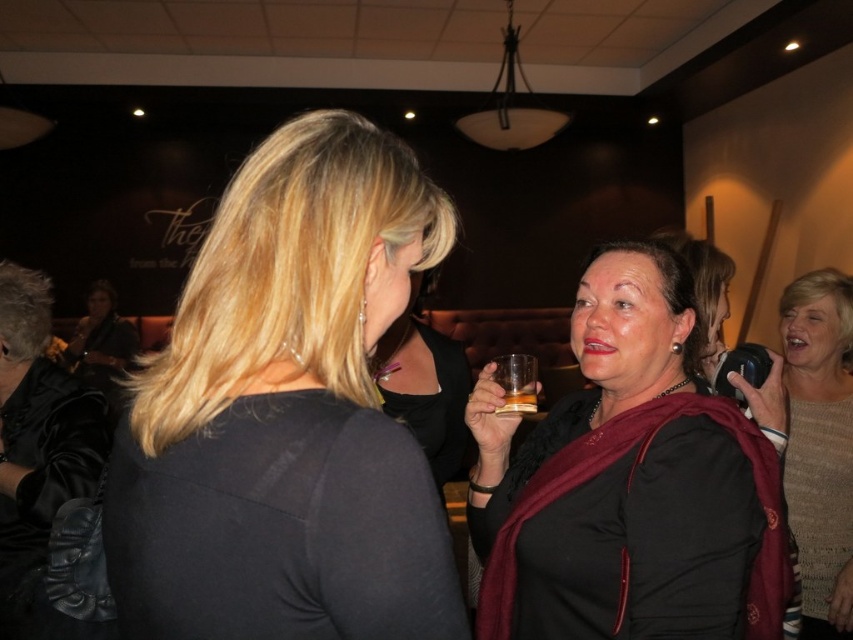
You are standing at point (90,298) and want to walk towards point (144,461). Which direction should you move relative to the two women in the image?

You should move forward because point (144,461) is in front of point (90,298), so moving towards it would be in the forward direction relative to your current position at point (90,298).

You are at a bar and need to grab the translucent glass at center without touching the satin black jacket at upper left. Is there enough space between them for you to reach the glass?

The satin black jacket at upper left is to the left of the translucent glass at center, so there is space between them. You can safely reach the glass without touching the jacket.

You are at a social gathering in a dimly lit bar. You see two points marked in the scene. The first point is at coordinate point (x=804, y=468) and the second point is at coordinate point (x=100, y=298). Which point is closer to you?

Point (x=804, y=468) is closer to the camera than point (x=100, y=298), so the first point is closer to you.